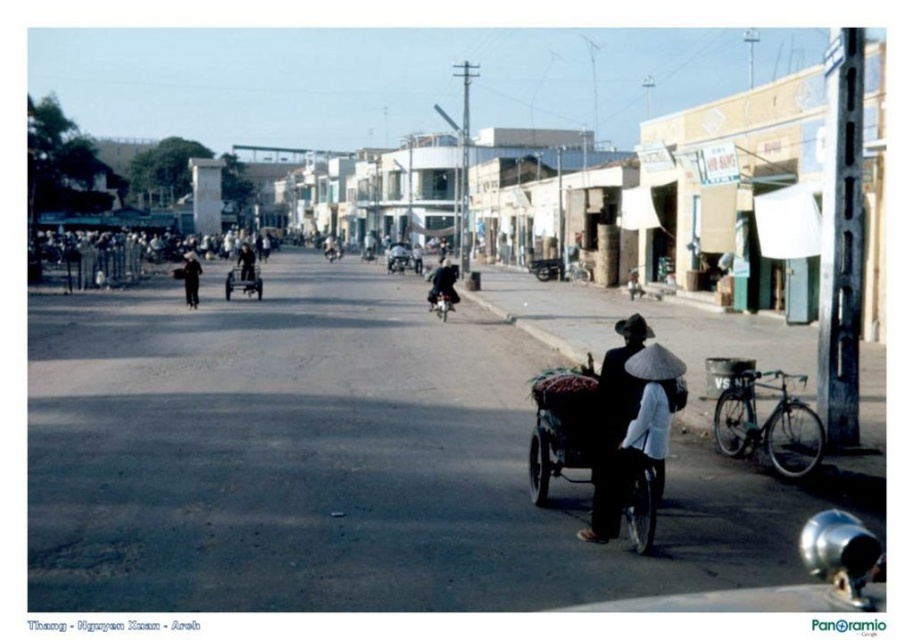
Between black matte person at center and dark blue fabric jacket at center, which one has more height?

black matte person at center

Which is behind, point (189, 253) or point (238, 257)?

The point (189, 253) is behind.

Image resolution: width=914 pixels, height=640 pixels. Identify the location of black matte person at center. (190, 276).

Can you confirm if black matte conical hat at center is positioned above dark blue fabric jacket at center?

Incorrect, black matte conical hat at center is not positioned above dark blue fabric jacket at center.

What do you see at coordinates (614, 429) in the screenshot? I see `black matte conical hat at center` at bounding box center [614, 429].

Find the location of `black matte conical hat at center`. black matte conical hat at center is located at coordinates (614, 429).

Does black matte conical hat at center have a smaller size compared to metallic silver rickshaw at center?

Yes, black matte conical hat at center is smaller than metallic silver rickshaw at center.

Between black matte conical hat at center and metallic silver rickshaw at center, which one is positioned lower?

Positioned lower is black matte conical hat at center.

This screenshot has width=914, height=640. What do you see at coordinates (614, 429) in the screenshot? I see `black matte conical hat at center` at bounding box center [614, 429].

In order to click on black matte conical hat at center in this screenshot , I will do `click(614, 429)`.